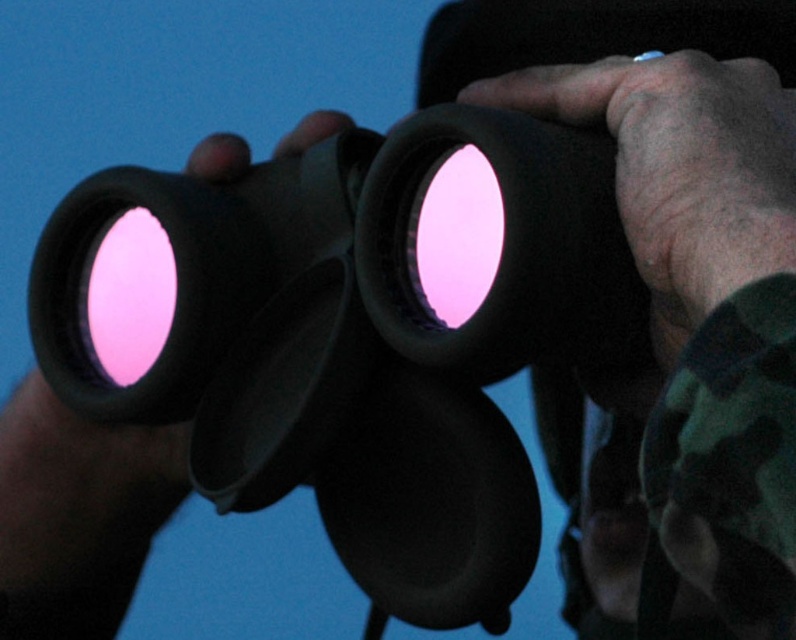
Question: Is camo fabric at center positioned in front of matte black binoculars at center?

Choices:
 (A) yes
 (B) no

Answer: (A)

Question: Is camo fabric at center wider than matte black binoculars at center?

Choices:
 (A) no
 (B) yes

Answer: (A)

Question: Does camo fabric at center have a larger size compared to matte black binoculars at center?

Choices:
 (A) no
 (B) yes

Answer: (A)

Question: Among these points, which one is farthest from the camera?

Choices:
 (A) (59, 524)
 (B) (742, 452)

Answer: (A)

Question: Which point is closer to the camera?

Choices:
 (A) (736, 604)
 (B) (10, 541)

Answer: (A)

Question: Among these objects, which one is nearest to the camera?

Choices:
 (A) camo fabric at center
 (B) matte black binoculars at center

Answer: (A)